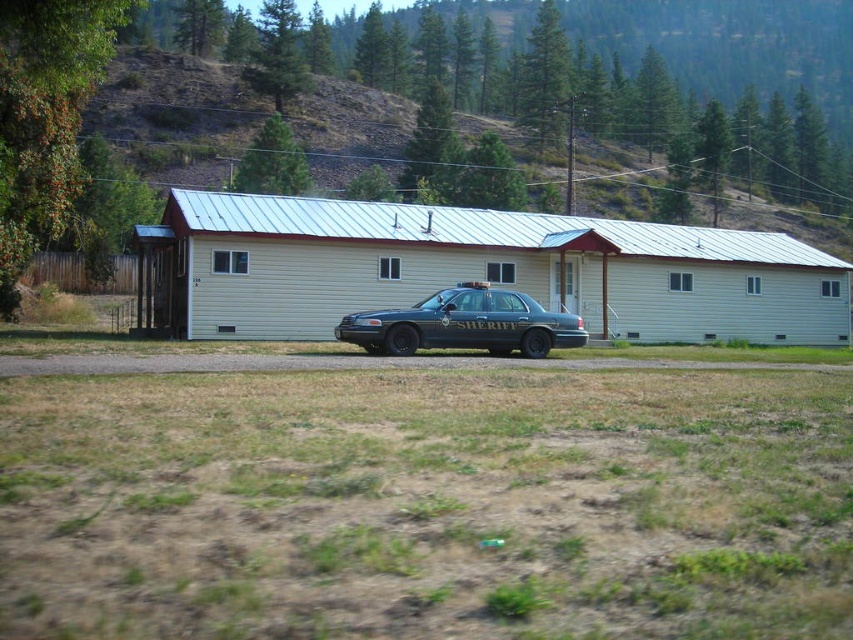
Does green grass at upper center come behind metallic blue sheriff car at center?

Yes, it is.

Is green grass at upper center thinner than metallic blue sheriff car at center?

A: No.

Is point (136, 76) more distant than point (489, 332)?

Yes, point (136, 76) is behind point (489, 332).

Locate an element on the screen. The width and height of the screenshot is (853, 640). green grass at upper center is located at coordinates (175, 115).